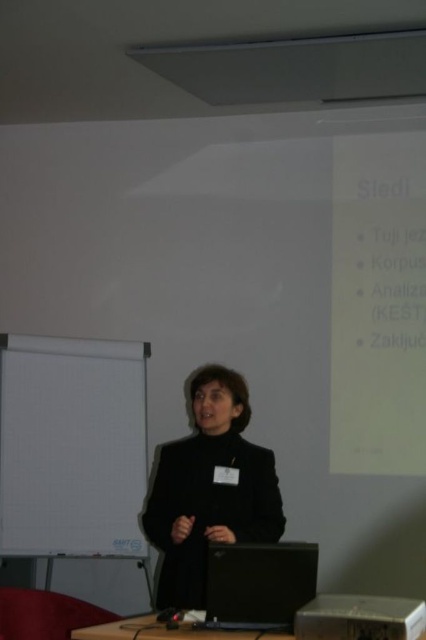
Looking at this image, who is positioned more to the left, black matte jacket at center or black plastic table at lower center?

From the viewer's perspective, black plastic table at lower center appears more on the left side.

Can you confirm if black matte jacket at center is positioned below black plastic table at lower center?

No, black matte jacket at center is not below black plastic table at lower center.

This screenshot has width=426, height=640. Describe the element at coordinates (209, 488) in the screenshot. I see `black matte jacket at center` at that location.

The image size is (426, 640). I want to click on black matte jacket at center, so click(209, 488).

Who is taller, white paper at center or black plastic projector at lower center?

white paper at center is taller.

Is white paper at center taller than black plastic projector at lower center?

Yes, white paper at center is taller than black plastic projector at lower center.

Between point (42, 348) and point (354, 616), which one is positioned behind?

Positioned behind is point (42, 348).

Identify the location of white paper at center. (71, 445).

What do you see at coordinates (71, 445) in the screenshot?
I see `white paper at center` at bounding box center [71, 445].

Between point (89, 442) and point (97, 636), which one is positioned in front?

Positioned in front is point (97, 636).

Locate an element on the screen. This screenshot has height=640, width=426. white paper at center is located at coordinates (71, 445).